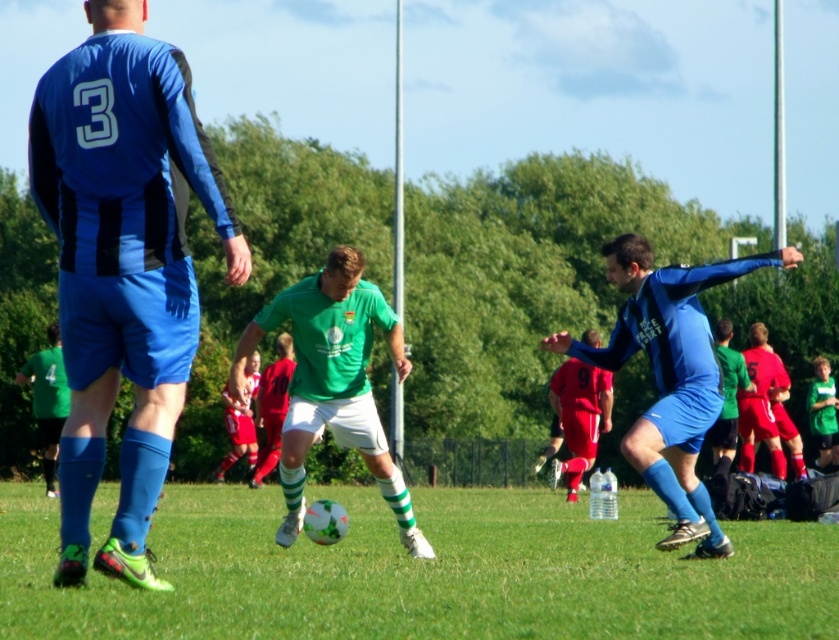
Question: Observing the image, what is the correct spatial positioning of green grass at center in reference to green matte jersey at lower left?

Choices:
 (A) right
 (B) left

Answer: (A)

Question: Observing the image, what is the correct spatial positioning of matte red shorts at right in reference to green matte jersey at lower left?

Choices:
 (A) above
 (B) below

Answer: (A)

Question: Does green grass at center have a lesser width compared to matte blue jersey at center?

Choices:
 (A) yes
 (B) no

Answer: (B)

Question: Which of the following is the farthest from the observer?

Choices:
 (A) green matte jersey at lower left
 (B) matte blue jersey at center
 (C) matte red shorts at right
 (D) green grass at center

Answer: (A)

Question: Based on their relative distances, which object is farther from the matte red shorts at right?

Choices:
 (A) green matte jersey at lower left
 (B) green jersey at center

Answer: (A)

Question: Among these objects, which one is farthest from the camera?

Choices:
 (A) green jersey at center
 (B) matte red shorts at right
 (C) green grass at center
 (D) green matte jersey at lower left

Answer: (D)